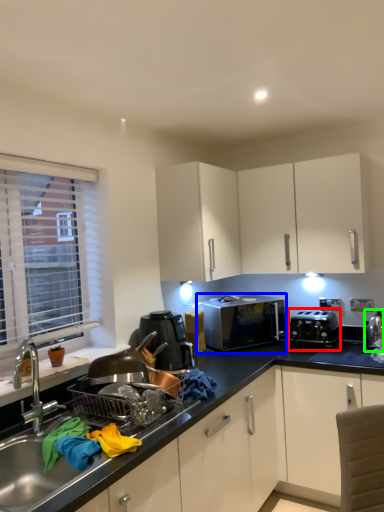
Question: Which object is the farthest from appliance (highlighted by a red box)? Choose among these: microwave oven (highlighted by a blue box) or appliance (highlighted by a green box).

Choices:
 (A) microwave oven
 (B) appliance

Answer: (B)